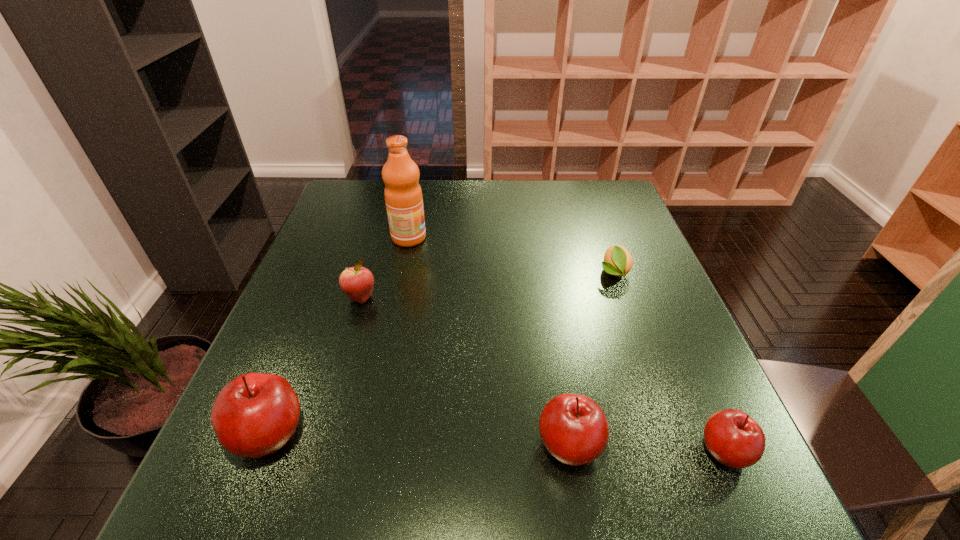
The width and height of the screenshot is (960, 540). What are the coordinates of `vacant region located on the back of the second shortest object` in the screenshot? It's located at (696, 385).

The width and height of the screenshot is (960, 540). Find the location of `free space located 0.250m with leaves positioned above the shortest object`. free space located 0.250m with leaves positioned above the shortest object is located at coordinates (648, 370).

The height and width of the screenshot is (540, 960). In order to click on free space located on the label side of the tallest object in this screenshot , I will do `click(444, 238)`.

Locate an element on the screen. This screenshot has height=540, width=960. free space located on the back of the farthest apple is located at coordinates (375, 249).

Locate an element on the screen. This screenshot has width=960, height=540. apple at the right edge is located at coordinates pos(733,438).

This screenshot has width=960, height=540. What are the coordinates of `lemon located at the right edge` in the screenshot? It's located at (618, 261).

In order to click on object positioned at the near left corner in this screenshot , I will do coord(254,415).

The image size is (960, 540). What are the coordinates of `object situated at the near right corner` in the screenshot? It's located at click(733, 438).

What are the coordinates of `vacant region at the near edge of the desktop` in the screenshot? It's located at (347, 418).

Find the location of a particular element. vacant region at the left edge of the desktop is located at coordinates (341, 269).